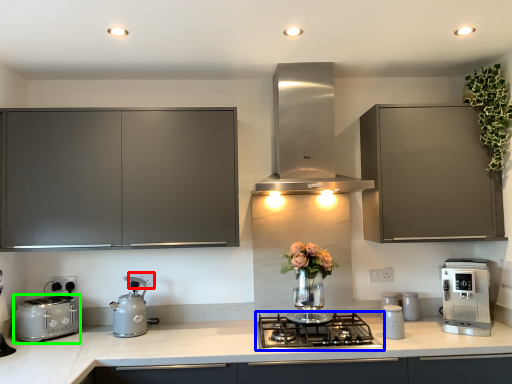
Question: Estimate the real-world distances between objects in this image. Which object is farther from electric outlet (highlighted by a red box), gas stove (highlighted by a blue box) or toaster (highlighted by a green box)?

Choices:
 (A) gas stove
 (B) toaster

Answer: (A)